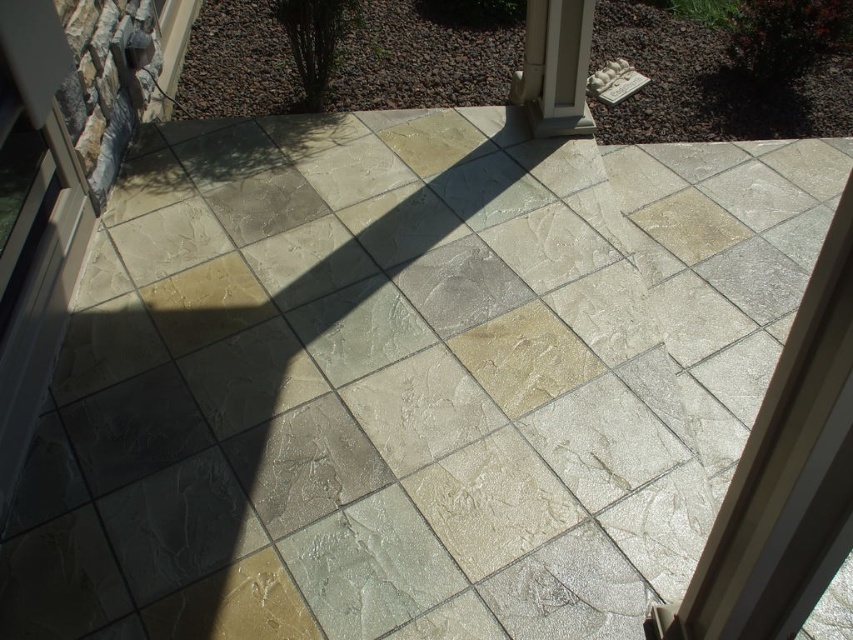
Question: Which point is farther from the camera taking this photo?

Choices:
 (A) (575, 122)
 (B) (3, 502)

Answer: (A)

Question: Can you confirm if white plastic screen door at left is positioned below white stone pillar at upper right?

Choices:
 (A) no
 (B) yes

Answer: (B)

Question: Does white plastic screen door at left appear over white stone pillar at upper right?

Choices:
 (A) no
 (B) yes

Answer: (A)

Question: Does white plastic screen door at left have a lesser width compared to white stone pillar at upper right?

Choices:
 (A) no
 (B) yes

Answer: (B)